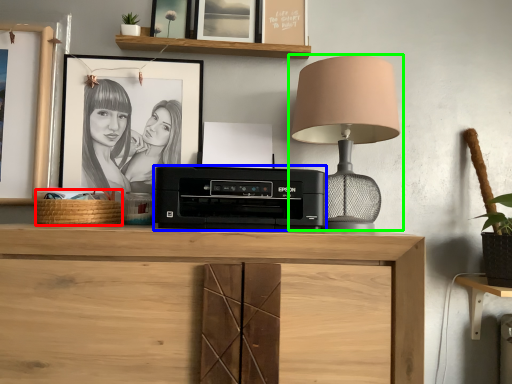
Question: Which object is the closest to the basket (highlighted by a red box)? Choose among these: printer (highlighted by a blue box) or lamp (highlighted by a green box).

Choices:
 (A) printer
 (B) lamp

Answer: (A)